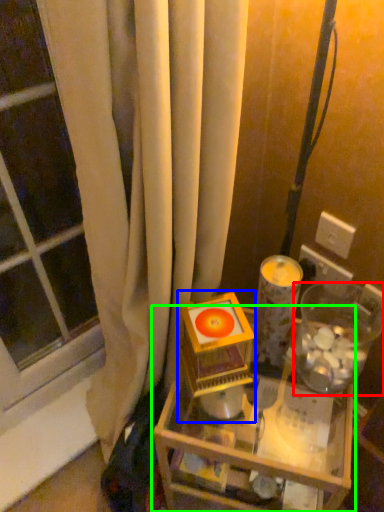
Question: Which is farther away from glass jar (highlighted by a red box)? toy (highlighted by a blue box) or table (highlighted by a green box)?

Choices:
 (A) toy
 (B) table

Answer: (B)